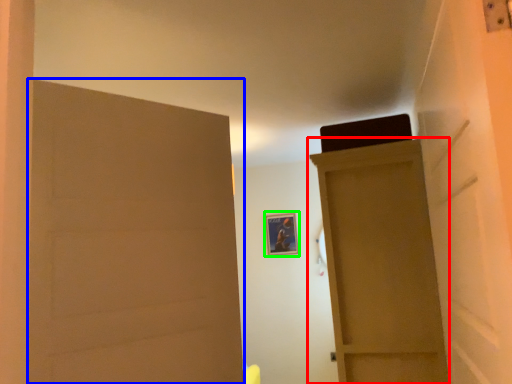
Question: Which object is positioned farthest from door (highlighted by a red box)? Select from door (highlighted by a blue box) and picture frame (highlighted by a green box).

Choices:
 (A) door
 (B) picture frame

Answer: (B)